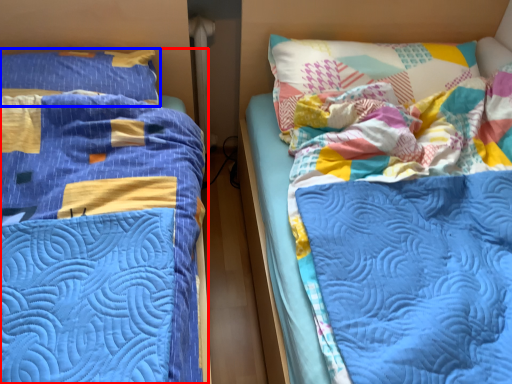
Question: Which object appears farthest to the camera in this image, bed (highlighted by a red box) or pillow (highlighted by a blue box)?

Choices:
 (A) bed
 (B) pillow

Answer: (B)